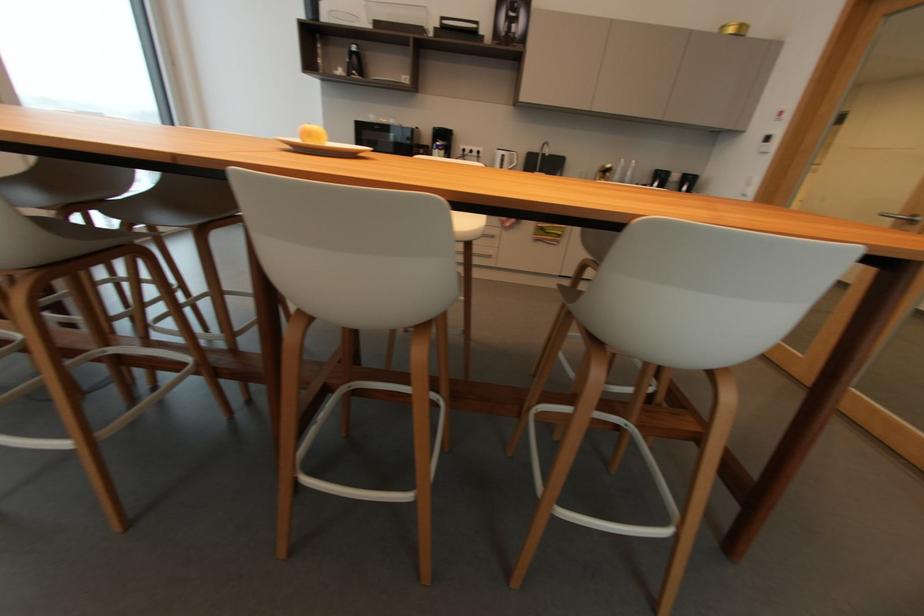
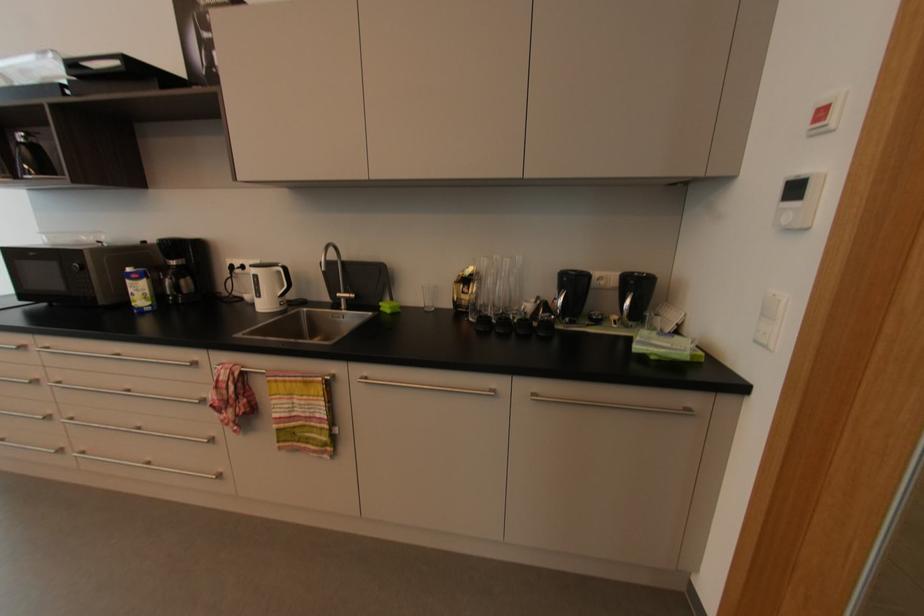
The point at (x=516, y=156) is marked in the first image. Where is the corresponding point in the second image?

(282, 273)